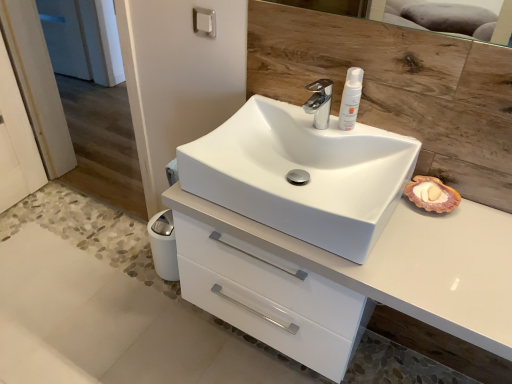
Question: Does white glossy sink at center have a larger size compared to white glossy cabinet at center?

Choices:
 (A) no
 (B) yes

Answer: (A)

Question: Is white glossy sink at center to the left of white glossy cabinet at center from the viewer's perspective?

Choices:
 (A) no
 (B) yes

Answer: (B)

Question: Considering the relative sizes of white glossy sink at center and white glossy cabinet at center in the image provided, is white glossy sink at center wider than white glossy cabinet at center?

Choices:
 (A) no
 (B) yes

Answer: (A)

Question: Is white glossy sink at center further to the viewer compared to white glossy cabinet at center?

Choices:
 (A) yes
 (B) no

Answer: (A)

Question: Is white glossy sink at center next to white glossy cabinet at center?

Choices:
 (A) no
 (B) yes

Answer: (A)

Question: Would you say white glossy cabinet at center is to the left or to the right of white glossy sink at center in the picture?

Choices:
 (A) left
 (B) right

Answer: (B)

Question: Is white glossy cabinet at center inside or outside of white glossy sink at center?

Choices:
 (A) inside
 (B) outside

Answer: (B)

Question: From the image's perspective, is white glossy cabinet at center above or below white glossy sink at center?

Choices:
 (A) above
 (B) below

Answer: (B)

Question: Is white glossy cabinet at center taller or shorter than white glossy sink at center?

Choices:
 (A) short
 (B) tall

Answer: (B)

Question: Would you say white glossy cabinet at center is to the left or to the right of chrome metallic faucet at center in the picture?

Choices:
 (A) right
 (B) left

Answer: (A)

Question: Looking at their shapes, would you say white glossy cabinet at center is wider or thinner than chrome metallic faucet at center?

Choices:
 (A) thin
 (B) wide

Answer: (B)

Question: In terms of height, does white glossy cabinet at center look taller or shorter compared to chrome metallic faucet at center?

Choices:
 (A) tall
 (B) short

Answer: (A)

Question: Would you say white glossy cabinet at center is inside or outside chrome metallic faucet at center?

Choices:
 (A) outside
 (B) inside

Answer: (A)

Question: From a real-world perspective, is chrome metallic faucet at center positioned above or below white glossy sink at center?

Choices:
 (A) above
 (B) below

Answer: (A)

Question: From the image's perspective, is chrome metallic faucet at center above or below white glossy sink at center?

Choices:
 (A) below
 (B) above

Answer: (B)